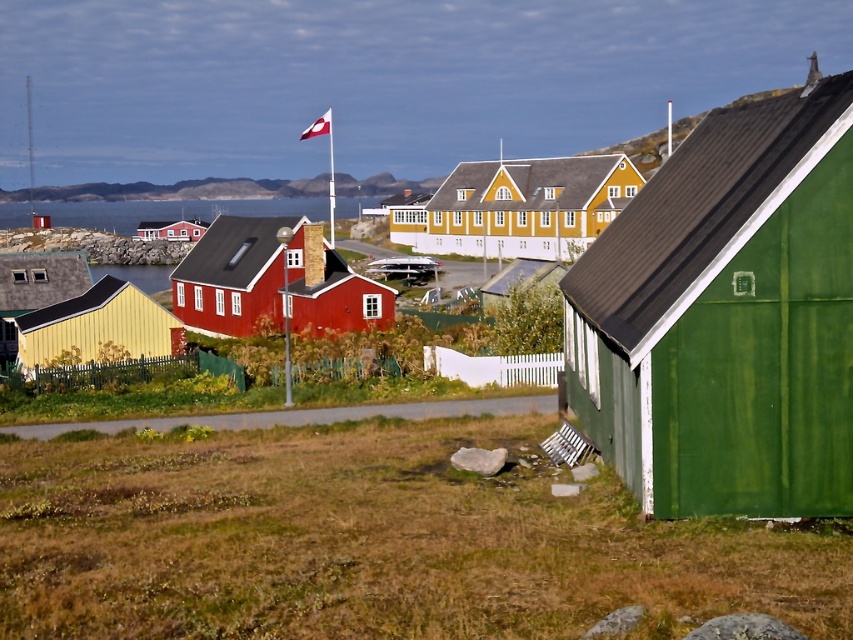
Question: Which point is closer to the camera taking this photo?

Choices:
 (A) (329, 124)
 (B) (22, 300)

Answer: (B)

Question: Is matte wooden house at center to the left of matte yellow hut at left from the viewer's perspective?

Choices:
 (A) no
 (B) yes

Answer: (A)

Question: Which object is positioned farthest from the yellow wood house at center?

Choices:
 (A) matte red house at center
 (B) yellow corrugated metal hut at left

Answer: (B)

Question: Does yellow corrugated metal hut at left appear on the left side of white fabric flag at upper center?

Choices:
 (A) yes
 (B) no

Answer: (B)

Question: Which object is closer to the camera taking this photo?

Choices:
 (A) matte red house at center
 (B) white fabric flag at upper center
 (C) yellow corrugated metal hut at left

Answer: (C)

Question: Considering the relative positions of yellow corrugated metal hut at left and transparent water at center in the image provided, where is yellow corrugated metal hut at left located with respect to transparent water at center?

Choices:
 (A) below
 (B) above

Answer: (A)